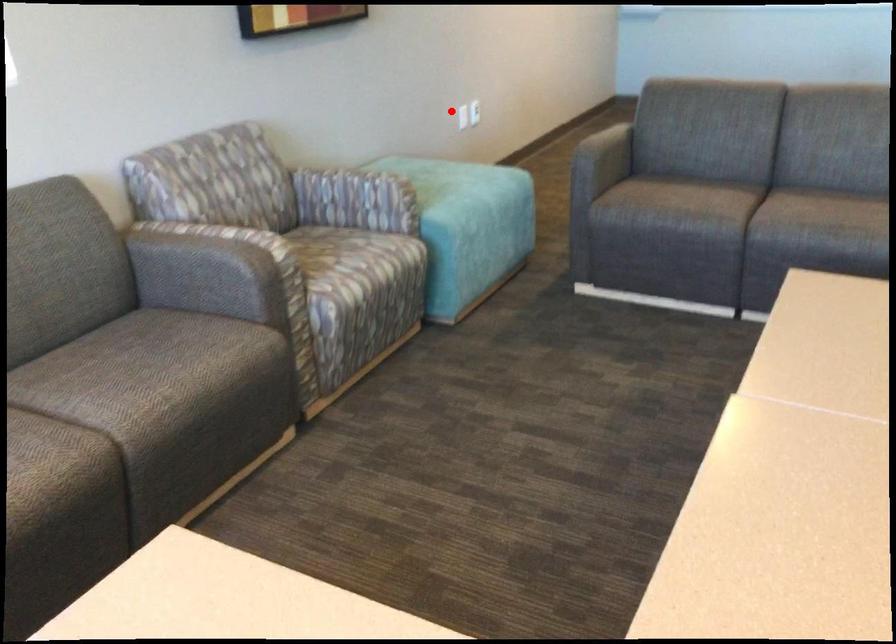
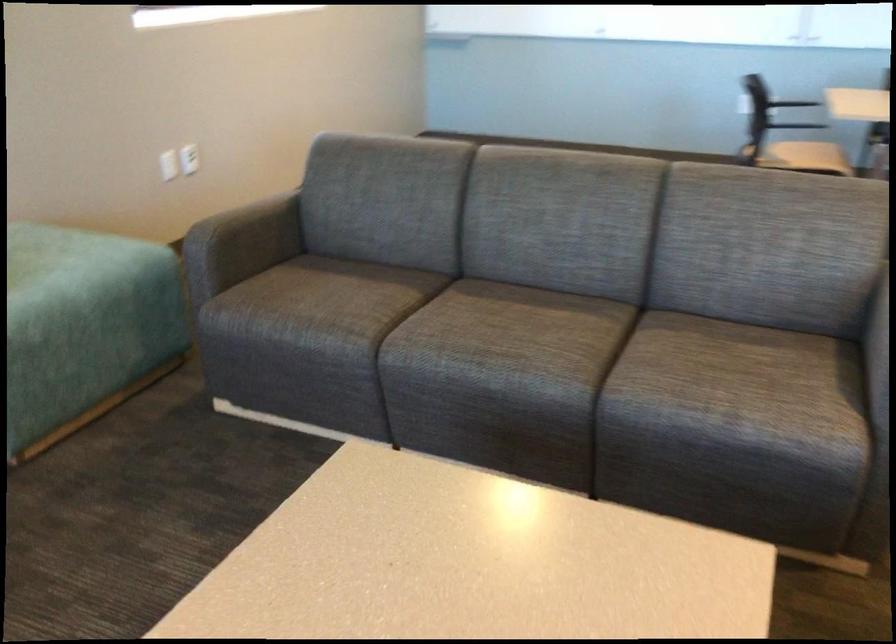
Question: I am providing you with two images of the same scene from different viewpoints. A red point is shown in image1. For the corresponding object point in image2, is it positioned nearer or farther from the camera?

Choices:
 (A) Nearer
 (B) Farther

Answer: (A)